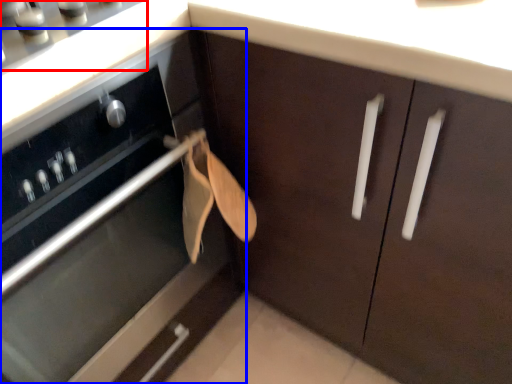
Question: Which object appears closest to the camera in this image, gas stove (highlighted by a red box) or cabinetry (highlighted by a blue box)?

Choices:
 (A) gas stove
 (B) cabinetry

Answer: (B)